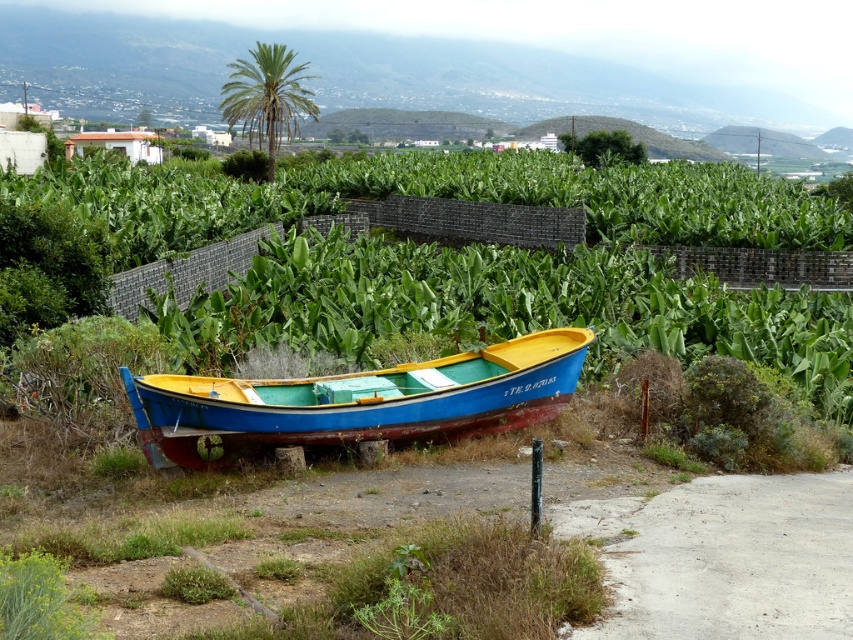
Does blue wooden boat at center appear on the right side of green leafy palm at upper center?

Yes, blue wooden boat at center is to the right of green leafy palm at upper center.

Looking at this image, is blue wooden boat at center to the left of green leafy palm at upper center from the viewer's perspective?

In fact, blue wooden boat at center is to the right of green leafy palm at upper center.

The height and width of the screenshot is (640, 853). Identify the location of blue wooden boat at center. (360, 401).